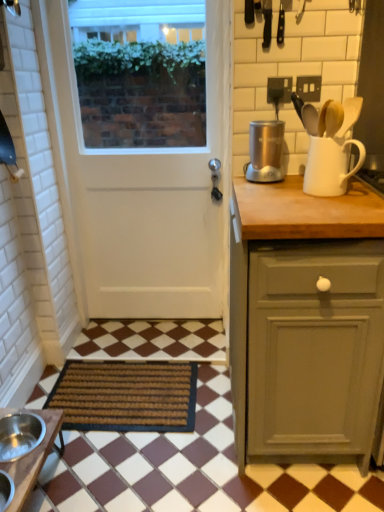
At what (x,y) coordinates should I click in order to perform the action: click on free point above matte gray cabinet at right (from a real-world perspective). Please return your answer as a coordinate pair (x, y). The width and height of the screenshot is (384, 512). Looking at the image, I should click on (309, 198).